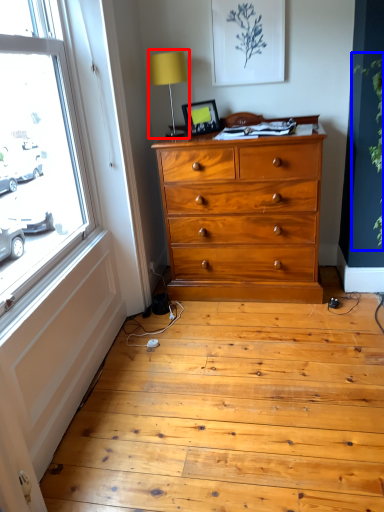
Question: Which of the following is the farthest to the observer, table lamp (highlighted by a red box) or plant (highlighted by a blue box)?

Choices:
 (A) table lamp
 (B) plant

Answer: (A)